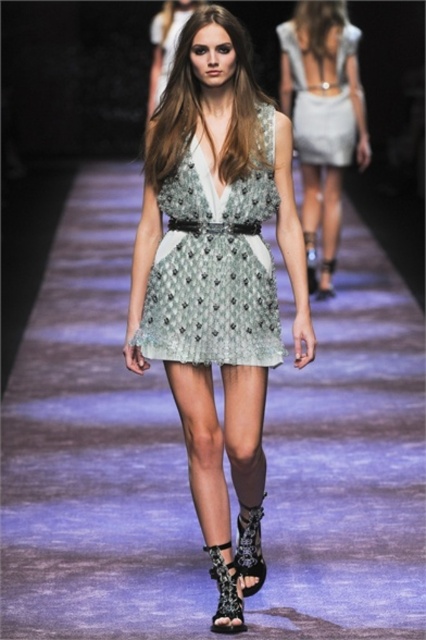
Question: Does light gray sheer fabric dress at upper center have a lesser width compared to leather lace-up sandal at center?

Choices:
 (A) no
 (B) yes

Answer: (A)

Question: Which point is farther from the camera taking this photo?

Choices:
 (A) (239, 614)
 (B) (314, 120)

Answer: (B)

Question: Among these points, which one is nearest to the camera?

Choices:
 (A) (250, 388)
 (B) (342, 1)

Answer: (A)

Question: Based on their relative distances, which object is farther from the black lace sandal at lower center?

Choices:
 (A) leather lace-up sandal at center
 (B) light gray sheer fabric dress at upper center

Answer: (B)

Question: Observing the image, what is the correct spatial positioning of light gray sheer fabric dress at upper center in reference to black leather sandal at center?

Choices:
 (A) below
 (B) above

Answer: (B)

Question: Does lace dress at center have a larger size compared to satin-like silver dress at center?

Choices:
 (A) no
 (B) yes

Answer: (B)